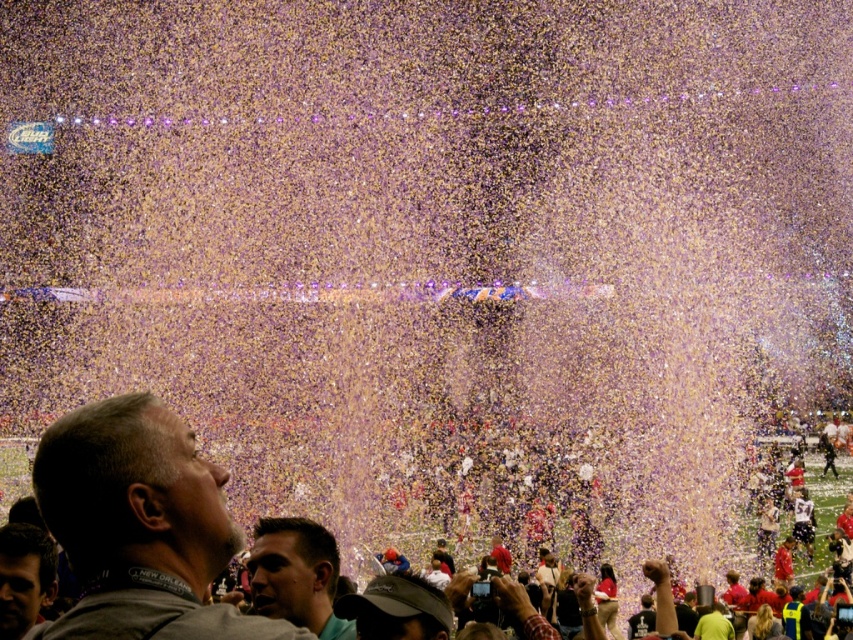
Question: Can you confirm if gray fabric shirt at lower left is bigger than multicolored confetti at center?

Choices:
 (A) no
 (B) yes

Answer: (A)

Question: Which point is closer to the camera taking this photo?

Choices:
 (A) (86, 614)
 (B) (285, 554)
 (C) (140, 524)

Answer: (A)

Question: Which object is the closest to the smooth skin face at lower left?

Choices:
 (A) multicolored confetti at center
 (B) gray fabric shirt at lower left

Answer: (B)

Question: Is gray fabric shirt at lower left further to the viewer compared to green matte shirt at lower center?

Choices:
 (A) no
 (B) yes

Answer: (A)

Question: Does multicolored confetti at center appear under green matte shirt at lower center?

Choices:
 (A) no
 (B) yes

Answer: (A)

Question: Which point is farther to the camera?

Choices:
 (A) multicolored confetti at center
 (B) smooth skin face at lower left
 (C) gray fabric shirt at lower left
 (D) green matte shirt at lower center

Answer: (D)